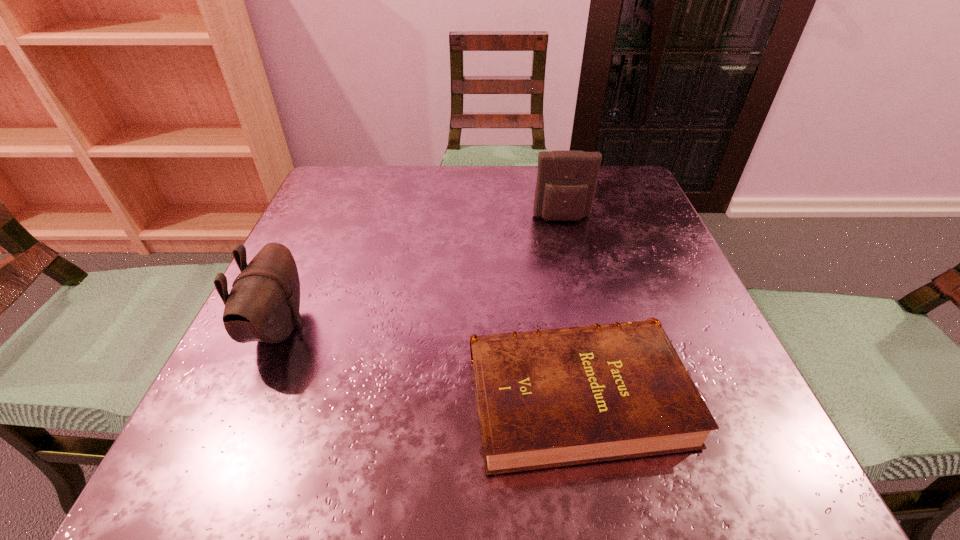
You are a GUI agent. You are given a task and a screenshot of the screen. Output one action in this format:
    pyautogui.click(x=<x>, y=<y>)
    Task: Click on the object located in the left edge section of the desktop
    The image size is (960, 540).
    Given the screenshot: What is the action you would take?
    pyautogui.click(x=263, y=305)

Locate an element on the screen. The height and width of the screenshot is (540, 960). pouch at the right edge is located at coordinates coord(566,180).

I want to click on hardback book that is at the right edge, so click(547, 398).

At what (x,y) coordinates should I click in order to perform the action: click on object that is at the far right corner. Please return your answer as a coordinate pair (x, y). The height and width of the screenshot is (540, 960). Looking at the image, I should click on [x=566, y=180].

At what (x,y) coordinates should I click in order to perform the action: click on object that is at the near right corner. Please return your answer as a coordinate pair (x, y). The image size is (960, 540). Looking at the image, I should click on (547, 398).

At what (x,y) coordinates should I click in order to perform the action: click on vacant space at the far edge. Please return your answer as a coordinate pair (x, y). The width and height of the screenshot is (960, 540). Looking at the image, I should click on (401, 174).

Where is `vacant space at the near edge of the desktop`? The image size is (960, 540). vacant space at the near edge of the desktop is located at coordinates (410, 461).

Locate an element on the screen. vacant space at the left edge of the desktop is located at coordinates [255, 342].

The image size is (960, 540). In the image, there is a desktop. In order to click on vacant space at the right edge in this screenshot , I will do `click(691, 293)`.

What are the coordinates of `vacant area at the near left corner` in the screenshot? It's located at (256, 445).